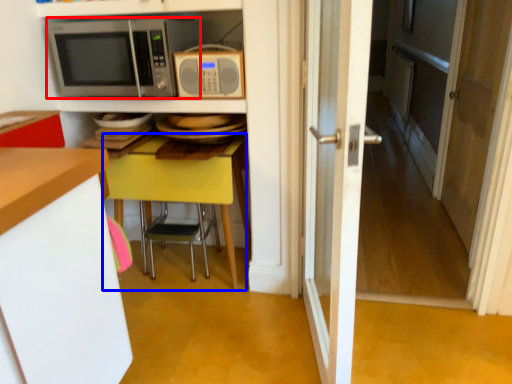
Question: Which object is closer to the camera taking this photo, microwave oven (highlighted by a red box) or table (highlighted by a blue box)?

Choices:
 (A) microwave oven
 (B) table

Answer: (A)